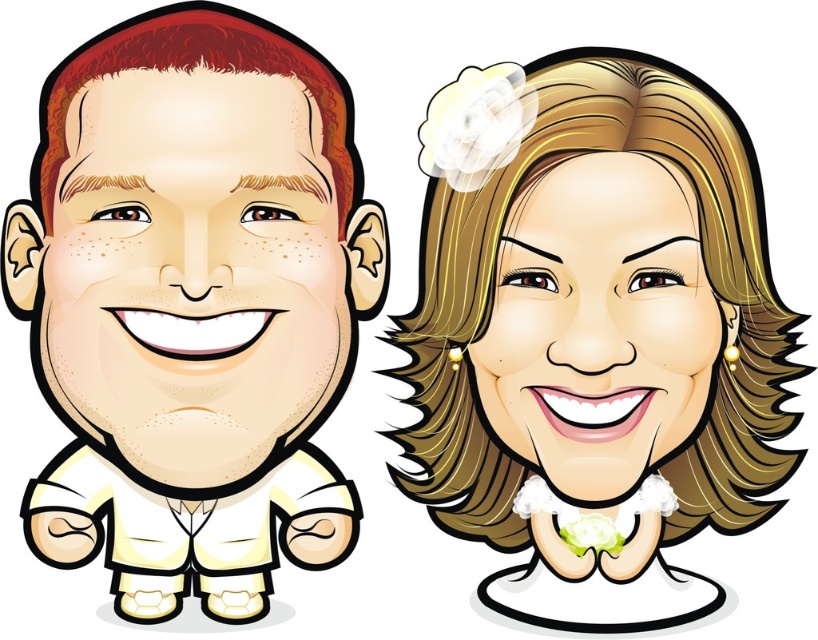
Consider the image. You are a photographer at a wedding reception and see the matte yellow face at left and the smooth blonde hair at center in your camera frame. Which object is located to the left of the other?

The matte yellow face at left is positioned on the left side of smooth blonde hair at center, so the matte yellow face at left is to the left of the smooth blonde hair at center.

You are a photographer at a wedding venue and need to adjust the lighting to ensure both the smooth blonde hair at upper right and the matte yellow face at left are evenly illuminated. Given their positions, which object should you focus the light on first to account for their height difference?

The smooth blonde hair at upper right is taller than the matte yellow face at left, so you should focus the light on the smooth blonde hair at upper right first to ensure it receives adequate illumination before adjusting for the shorter matte yellow face at left.